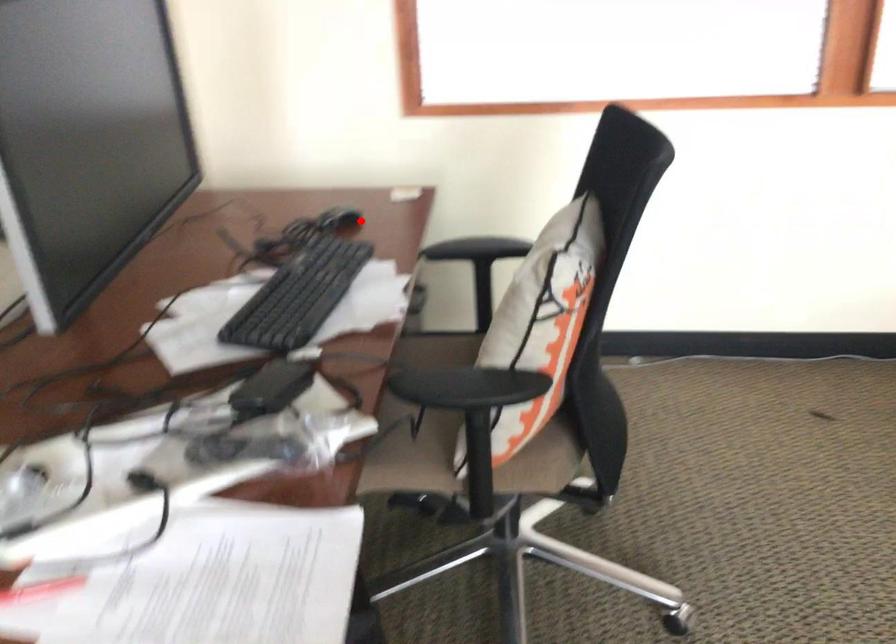
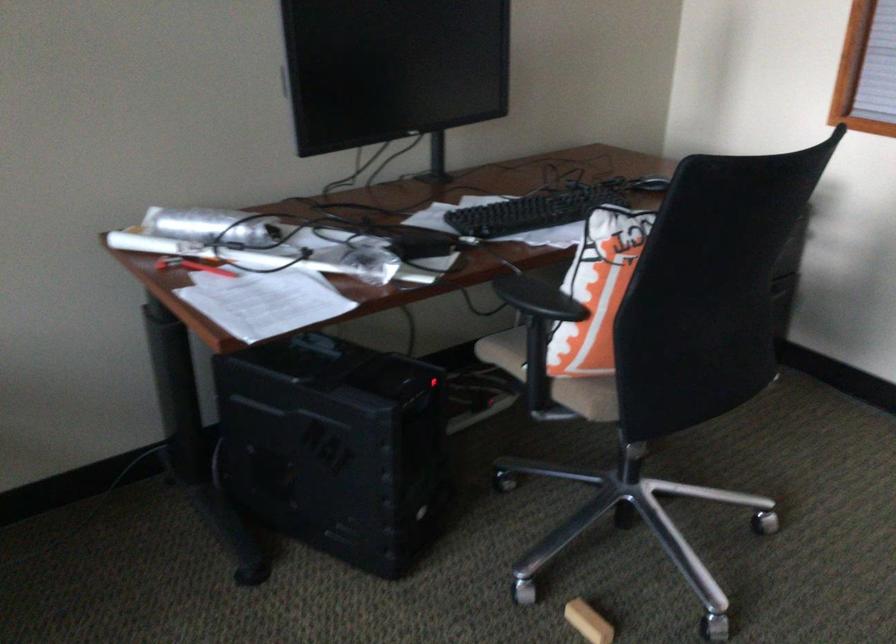
Find the pixel in the second image that matches the highlighted location in the first image.

(648, 185)